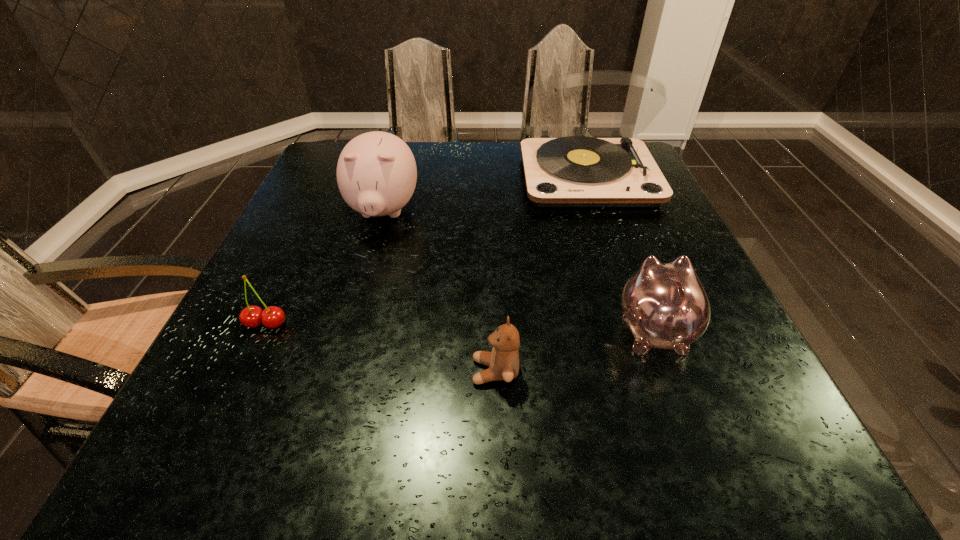
Find the location of `piggy bank located in the right edge section of the desktop`. piggy bank located in the right edge section of the desktop is located at coordinates (665, 305).

Identify the location of object that is at the far right corner. (576, 171).

Locate an element on the screen. This screenshot has height=540, width=960. free space at the far edge of the desktop is located at coordinates (517, 142).

Identify the location of vacant space at the near edge. The height and width of the screenshot is (540, 960). (275, 466).

In the image, there is a desktop. Identify the location of vacant space at the left edge. Image resolution: width=960 pixels, height=540 pixels. (331, 280).

This screenshot has width=960, height=540. I want to click on free space at the right edge of the desktop, so click(x=627, y=217).

Locate an element on the screen. unoccupied position between the record player and the farther piggy bank is located at coordinates (486, 194).

The height and width of the screenshot is (540, 960). Identify the location of blank region between the cherry and the record player. (426, 249).

I want to click on unoccupied area between the third object from left to right and the third shortest object, so click(574, 350).

Where is `vacant space in between the third object from right to left and the record player`? The image size is (960, 540). vacant space in between the third object from right to left and the record player is located at coordinates (541, 273).